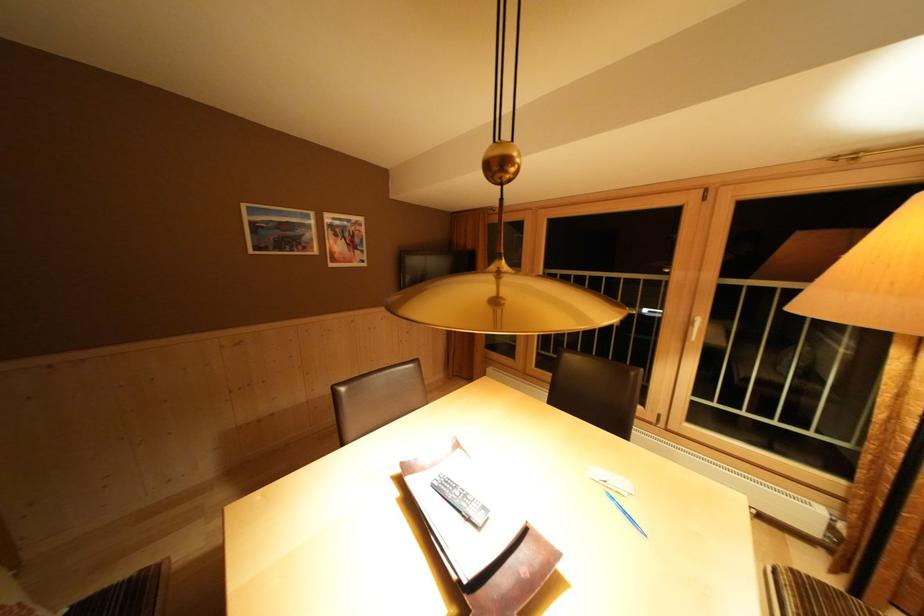
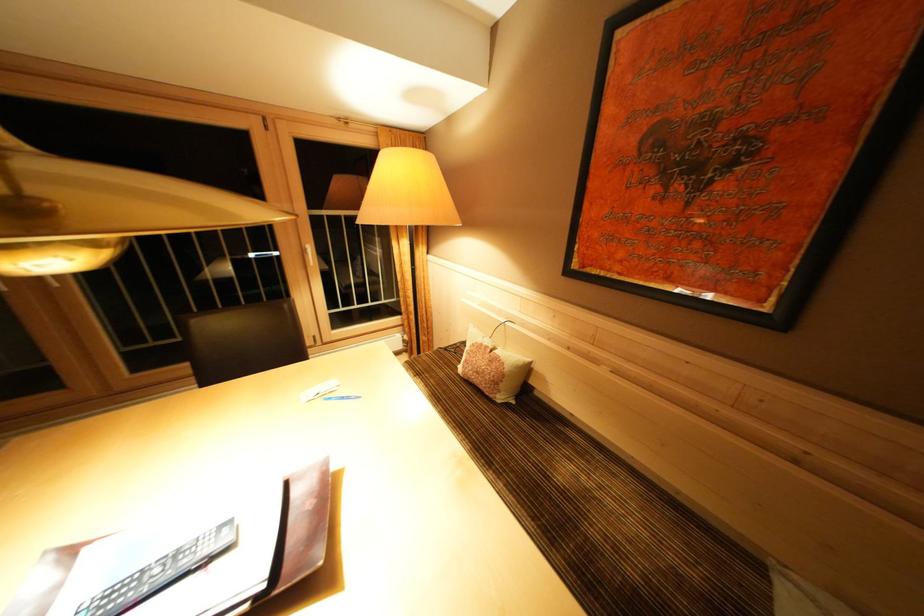
Find the pixel in the second image that matches point 697,328 in the first image.

(310, 256)